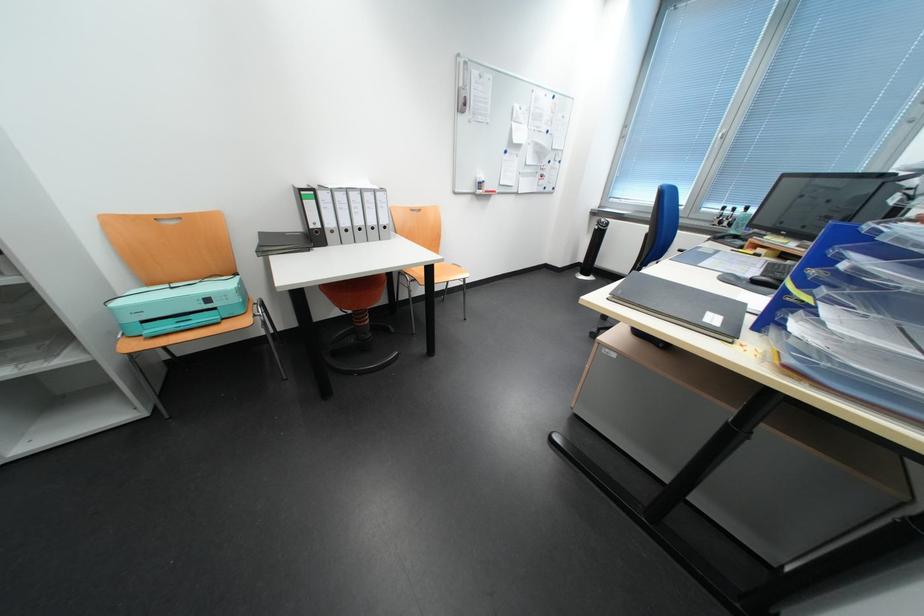
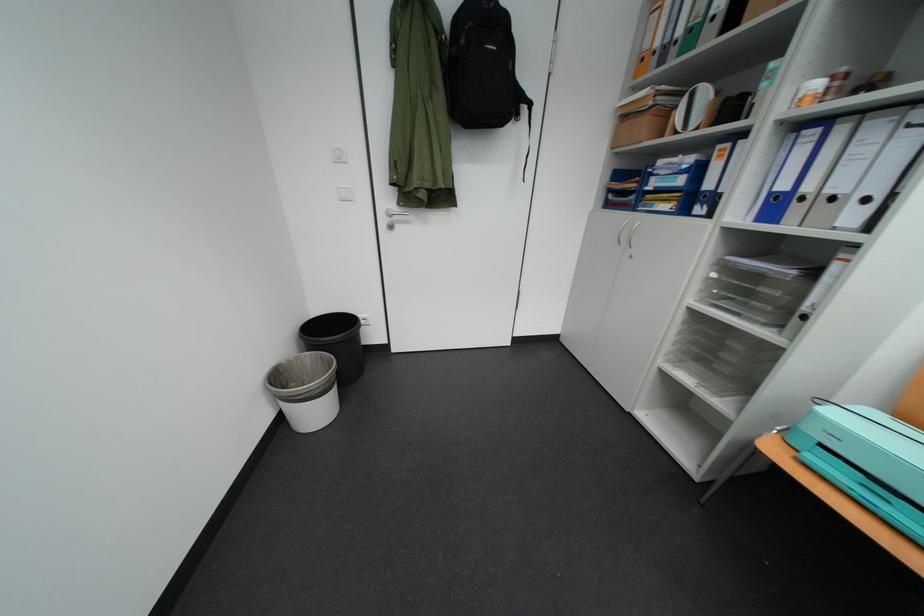
The first image is from the beginning of the video and the second image is from the end. How did the camera likely rotate when shooting the video?

The camera rotated toward left-down.